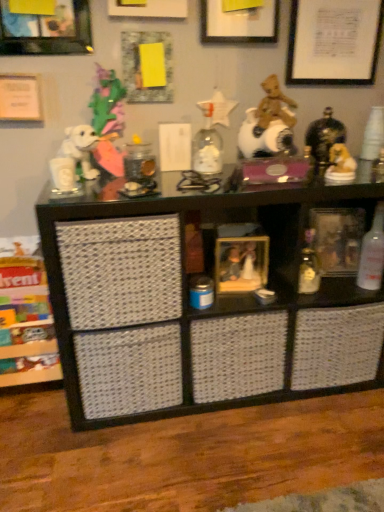
Where is `black woven basket at center, positioned as the 2th shelf in left-to-right order`? The width and height of the screenshot is (384, 512). black woven basket at center, positioned as the 2th shelf in left-to-right order is located at coordinates (201, 311).

Image resolution: width=384 pixels, height=512 pixels. Describe the element at coordinates (324, 139) in the screenshot. I see `shiny black vase at upper right, which is counted as the 3th toy, starting from the bottom` at that location.

Identify the location of translucent glass bottle at right, the first toy from the bottom. Image resolution: width=384 pixels, height=512 pixels. (309, 266).

Describe the element at coordinates (309, 266) in the screenshot. I see `translucent glass bottle at right, which is the 3th toy in top-to-bottom order` at that location.

How much space does brushed metal picture frame at upper left, marked as the fifth picture frame in a right-to-left arrangement, occupy vertically?

9.96 inches.

What do you see at coordinates (148, 8) in the screenshot?
I see `white paper at upper center, the 1th picture frame in the top-to-bottom sequence` at bounding box center [148, 8].

Locate an element on the screen. The height and width of the screenshot is (512, 384). clear glass bottle at right is located at coordinates (372, 253).

Is black woven basket at center, positioned as the 2th shelf in left-to-right order, aimed at translucent glass bottle at right, which is the 3th toy in top-to-bottom order?

Yes, black woven basket at center, positioned as the 2th shelf in left-to-right order, is facing translucent glass bottle at right, which is the 3th toy in top-to-bottom order.

Locate an element on the screen. the 1st shelf located beneath the translucent glass bottle at right, which is the 3th toy in top-to-bottom order (from a real-world perspective) is located at coordinates (201, 311).

From the image's perspective, relative to translucent glass bottle at right, which is the 3th toy in top-to-bottom order, is black woven basket at center, placed as the first shelf when sorted from right to left, above or below?

From the image's perspective, black woven basket at center, placed as the first shelf when sorted from right to left, appears below translucent glass bottle at right, which is the 3th toy in top-to-bottom order.

In the scene shown: Is white glossy horse at upper right, acting as the 2th toy starting from the top, inside or outside of white matte picture frame at upper right, positioned as the first picture frame in right-to-left order?

The correct answer is: outside.

From a real-world perspective, is white glossy horse at upper right, acting as the 2th toy starting from the top, physically located above or below white matte picture frame at upper right, which is the 3th picture frame in bottom-to-top order?

white glossy horse at upper right, acting as the 2th toy starting from the top, is below white matte picture frame at upper right, which is the 3th picture frame in bottom-to-top order.

Is white glossy horse at upper right, acting as the 2th toy starting from the top, touching white matte picture frame at upper right, positioned as the first picture frame in right-to-left order?

No, white glossy horse at upper right, acting as the 2th toy starting from the top, is not in contact with white matte picture frame at upper right, positioned as the first picture frame in right-to-left order.

Is white matte picture frame at upper right, positioned as the first picture frame in right-to-left order, positioned beyond the bounds of white paper at upper center, which ranks as the second picture frame in left-to-right order?

Yes, white matte picture frame at upper right, positioned as the first picture frame in right-to-left order, is outside of white paper at upper center, which ranks as the second picture frame in left-to-right order.

Is white matte picture frame at upper right, arranged as the fifth picture frame when viewed from the left, wider or thinner than white paper at upper center, marked as the fifth picture frame in a bottom-to-top arrangement?

Considering their sizes, white matte picture frame at upper right, arranged as the fifth picture frame when viewed from the left, looks slimmer than white paper at upper center, marked as the fifth picture frame in a bottom-to-top arrangement.

From the picture: Which is more to the right, white matte picture frame at upper right, arranged as the third picture frame when viewed from the top, or white paper at upper center, marked as the fifth picture frame in a bottom-to-top arrangement?

Positioned to the right is white matte picture frame at upper right, arranged as the third picture frame when viewed from the top.

Between shiny black vase at upper right, which is counted as the 3th toy, starting from the bottom, and brushed metal picture frame at upper left, acting as the 4th picture frame starting from the top, which one appears on the right side from the viewer's perspective?

Positioned to the right is shiny black vase at upper right, which is counted as the 3th toy, starting from the bottom.

Is shiny black vase at upper right, acting as the first toy starting from the top, far from brushed metal picture frame at upper left, marked as the fifth picture frame in a right-to-left arrangement?

shiny black vase at upper right, acting as the first toy starting from the top, is actually quite close to brushed metal picture frame at upper left, marked as the fifth picture frame in a right-to-left arrangement.

Which is behind, point (319, 128) or point (21, 42)?

Positioned behind is point (319, 128).

Is the position of shiny black vase at upper right, which is counted as the 3th toy, starting from the bottom, less distant than that of brushed metal picture frame at upper left, which is counted as the 2th picture frame, starting from the bottom?

No, shiny black vase at upper right, which is counted as the 3th toy, starting from the bottom, is behind brushed metal picture frame at upper left, which is counted as the 2th picture frame, starting from the bottom.

Is white glossy horse at upper right, the 2th toy when ordered from bottom to top, facing away from matte white picture frame at upper center, the third picture frame from the right?

That's not correct — white glossy horse at upper right, the 2th toy when ordered from bottom to top, is not looking away from matte white picture frame at upper center, the third picture frame from the right.

From the image's perspective, does white glossy horse at upper right, the 2th toy when ordered from bottom to top, appear lower than matte white picture frame at upper center, the third picture frame from the right?

Correct, white glossy horse at upper right, the 2th toy when ordered from bottom to top, appears lower than matte white picture frame at upper center, the third picture frame from the right, in the image.

In the scene shown: Which is more to the left, white glossy horse at upper right, the 2th toy when ordered from bottom to top, or matte white picture frame at upper center, acting as the 4th picture frame starting from the bottom?

Positioned to the left is matte white picture frame at upper center, acting as the 4th picture frame starting from the bottom.

Which is in front, point (269, 382) or point (335, 16)?

The point (335, 16) is more forward.

Could you tell me if black woven basket at center, positioned as the 2th shelf in left-to-right order, is turned towards white matte picture frame at upper right, arranged as the third picture frame when viewed from the top?

No, black woven basket at center, positioned as the 2th shelf in left-to-right order, is not oriented towards white matte picture frame at upper right, arranged as the third picture frame when viewed from the top.

From the picture: From a real-world perspective, who is located lower, black woven basket at center, placed as the first shelf when sorted from right to left, or white matte picture frame at upper right, arranged as the fifth picture frame when viewed from the left?

black woven basket at center, placed as the first shelf when sorted from right to left.

Which shelf is the 1st one when counting from the left side of the white matte picture frame at upper right, arranged as the fifth picture frame when viewed from the left? Please provide its 2D coordinates.

[(201, 311)]

Which object is further away from the camera taking this photo, white glossy horse at upper right, acting as the 2th toy starting from the top, or wooden picture frame at center, marked as the 5th picture frame in a top-to-bottom arrangement?

wooden picture frame at center, marked as the 5th picture frame in a top-to-bottom arrangement, is more distant.

From the image's perspective, is white glossy horse at upper right, the 2th toy when ordered from bottom to top, beneath wooden picture frame at center, which is the first picture frame in bottom-to-top order?

No, from the image's perspective, white glossy horse at upper right, the 2th toy when ordered from bottom to top, is not below wooden picture frame at center, which is the first picture frame in bottom-to-top order.

Is white glossy horse at upper right, the 2th toy when ordered from bottom to top, wider than wooden picture frame at center, which ranks as the second picture frame in right-to-left order?

No.

Is white glossy horse at upper right, acting as the 2th toy starting from the top, looking in the opposite direction of wooden picture frame at center, which is the first picture frame in bottom-to-top order?

No, white glossy horse at upper right, acting as the 2th toy starting from the top,'s orientation is not away from wooden picture frame at center, which is the first picture frame in bottom-to-top order.

There is a black woven basket at center, placed as the first shelf when sorted from right to left. At what (x,y) coordinates should I click in order to perform the action: click on the 1st toy above it (from the image's perspective). Please return your answer as a coordinate pair (x, y). This screenshot has width=384, height=512. Looking at the image, I should click on (309, 266).

Where is `toy that is the 2nd object located below the white matte picture frame at upper right, which is the 3th picture frame in bottom-to-top order (from the image's perspective)`? The image size is (384, 512). toy that is the 2nd object located below the white matte picture frame at upper right, which is the 3th picture frame in bottom-to-top order (from the image's perspective) is located at coordinates (340, 165).

Which object lies further to the anchor point shiny black vase at upper right, which is counted as the 3th toy, starting from the bottom, white glossy horse at upper right, the 2th toy when ordered from bottom to top, or translucent glass bottle at right, which is the 3th toy in top-to-bottom order?

The object further to shiny black vase at upper right, which is counted as the 3th toy, starting from the bottom, is translucent glass bottle at right, which is the 3th toy in top-to-bottom order.

When comparing their distances from shiny black vase at upper right, acting as the first toy starting from the top, does white matte picture frame at upper right, positioned as the first picture frame in right-to-left order, or clear glass bottle at right seem further?

clear glass bottle at right is positioned further to the anchor shiny black vase at upper right, acting as the first toy starting from the top.

Considering their positions, is clear glass bottle at right positioned closer to black woven basket at center, placed as the first shelf when sorted from right to left, than white paper at upper center, the 1th picture frame in the top-to-bottom sequence?

clear glass bottle at right is positioned closer to the anchor black woven basket at center, placed as the first shelf when sorted from right to left.

When comparing their distances from translucent glass bottle at right, which is the 3th toy in top-to-bottom order, does shiny black vase at upper right, acting as the first toy starting from the top, or white glossy horse at upper right, acting as the 2th toy starting from the top, seem closer?

The object closer to translucent glass bottle at right, which is the 3th toy in top-to-bottom order, is white glossy horse at upper right, acting as the 2th toy starting from the top.

Looking at the image, which one is located closer to white paper at upper center, which ranks as the second picture frame in left-to-right order, white glossy horse at upper right, the 2th toy when ordered from bottom to top, or wooden picture frame at center, which ranks as the second picture frame in right-to-left order?

Based on the image, white glossy horse at upper right, the 2th toy when ordered from bottom to top, appears to be nearer to white paper at upper center, which ranks as the second picture frame in left-to-right order.

When comparing their distances from brushed metal picture frame at upper left, marked as the fifth picture frame in a right-to-left arrangement, does wooden crate at lower left, the 1th shelf in the left-to-right sequence, or white matte picture frame at upper right, arranged as the third picture frame when viewed from the top, seem further?

Among the two, wooden crate at lower left, the 1th shelf in the left-to-right sequence, is located further to brushed metal picture frame at upper left, marked as the fifth picture frame in a right-to-left arrangement.

When comparing their distances from white paper at upper center, marked as the fifth picture frame in a bottom-to-top arrangement, does clear glass bottle at right or wooden picture frame at center, which is the first picture frame in bottom-to-top order, seem closer?

wooden picture frame at center, which is the first picture frame in bottom-to-top order, lies closer to white paper at upper center, marked as the fifth picture frame in a bottom-to-top arrangement, than the other object.

Looking at this image, considering their positions, is brushed metal picture frame at upper left, the 1th picture frame when ordered from left to right, positioned closer to translucent glass bottle at right, the first toy from the bottom, than shiny black vase at upper right, acting as the first toy starting from the top?

shiny black vase at upper right, acting as the first toy starting from the top, is closer to translucent glass bottle at right, the first toy from the bottom.

I want to click on picture frame between brushed metal picture frame at upper left, marked as the fifth picture frame in a right-to-left arrangement, and wooden crate at lower left, the 1th shelf in the left-to-right sequence, vertically, so click(x=241, y=263).

Find the location of `toy that lies between shiny black vase at upper right, acting as the first toy starting from the top, and wooden picture frame at center, positioned as the 4th picture frame in left-to-right order, from top to bottom`. toy that lies between shiny black vase at upper right, acting as the first toy starting from the top, and wooden picture frame at center, positioned as the 4th picture frame in left-to-right order, from top to bottom is located at coordinates (340, 165).

At what (x,y) coordinates should I click in order to perform the action: click on bottle between white matte picture frame at upper right, positioned as the first picture frame in right-to-left order, and translucent glass bottle at right, the first toy from the bottom, in the up-down direction. Please return your answer as a coordinate pair (x, y). The image size is (384, 512). Looking at the image, I should click on (372, 253).

This screenshot has width=384, height=512. Find the location of `toy between white matte picture frame at upper right, positioned as the first picture frame in right-to-left order, and white glossy horse at upper right, acting as the 2th toy starting from the top, in the vertical direction`. toy between white matte picture frame at upper right, positioned as the first picture frame in right-to-left order, and white glossy horse at upper right, acting as the 2th toy starting from the top, in the vertical direction is located at coordinates (324, 139).